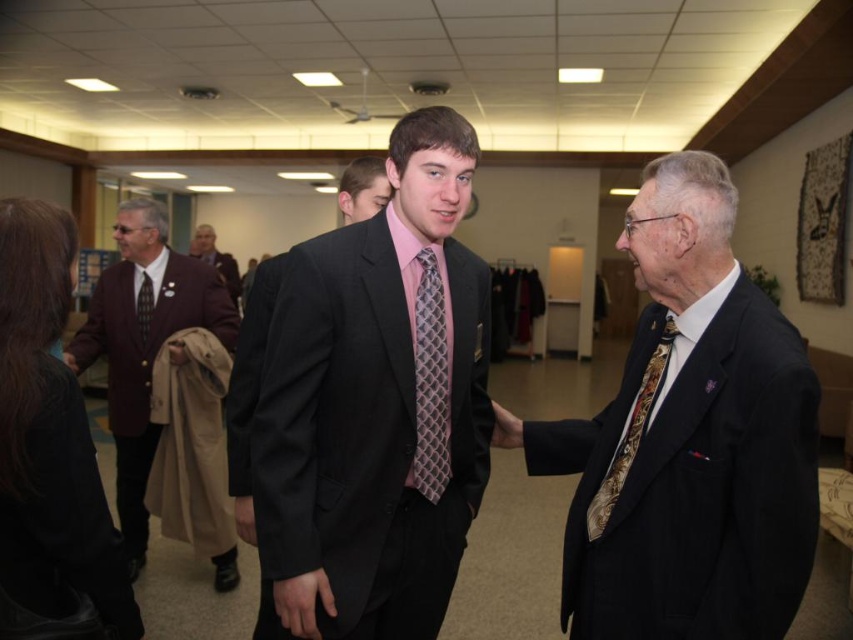
Who is more distant from viewer, (421,268) or (138,332)?

Positioned behind is point (138,332).

Measure the distance between point (419, 435) and camera.

The distance of point (419, 435) from camera is 1.59 meters.

Where is `pink textured tie at center`? pink textured tie at center is located at coordinates (430, 380).

Locate an element on the screen. pink textured tie at center is located at coordinates (430, 380).

Between matte black suit at center and maroon wool blazer at left, which one has more height?

Standing taller between the two is maroon wool blazer at left.

Can you confirm if matte black suit at center is smaller than maroon wool blazer at left?

Yes.

Which is in front, point (393, 548) or point (175, 288)?

Positioned in front is point (393, 548).

Identify the location of matte black suit at center. (376, 404).

Who is lower down, maroon wool blazer at left or light brown leather jacket at upper left?

maroon wool blazer at left is lower down.

Is maroon wool blazer at left to the left of light brown leather jacket at upper left from the viewer's perspective?

Incorrect, maroon wool blazer at left is not on the left side of light brown leather jacket at upper left.

Is point (193, 323) farther from viewer compared to point (207, 232)?

That is False.

Find the location of `maroon wool blazer at left`. maroon wool blazer at left is located at coordinates (142, 344).